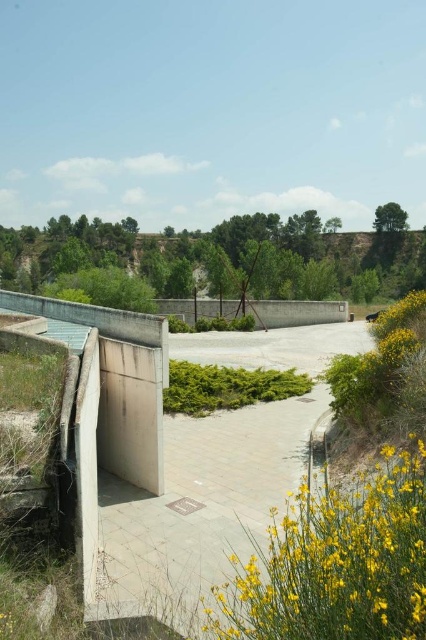
Question: Is concrete wall at center above green grassy hillside at center?

Choices:
 (A) yes
 (B) no

Answer: (B)

Question: Is concrete wall at center wider than concrete bunker at left?

Choices:
 (A) yes
 (B) no

Answer: (A)

Question: Does concrete wall at center have a smaller size compared to concrete bunker at left?

Choices:
 (A) no
 (B) yes

Answer: (A)

Question: Among these objects, which one is nearest to the camera?

Choices:
 (A) green grassy hillside at center
 (B) yellow matte flowers at lower right
 (C) concrete wall at center
 (D) concrete bunker at left

Answer: (B)

Question: Which point is farther to the camera?

Choices:
 (A) concrete wall at center
 (B) yellow matte flowers at lower right
 (C) green grassy hillside at center
 (D) concrete bunker at left

Answer: (C)

Question: Among these objects, which one is farthest from the camera?

Choices:
 (A) green grassy hillside at center
 (B) concrete bunker at left
 (C) yellow matte flowers at lower right

Answer: (A)